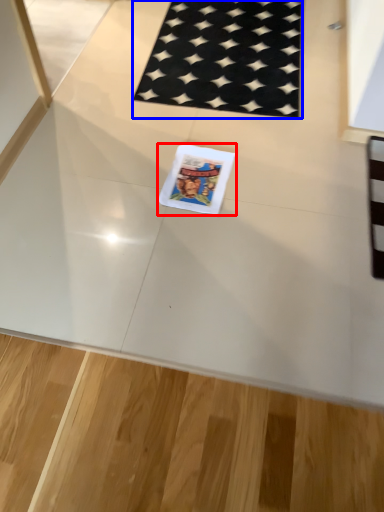
Question: Which object is closer to the camera taking this photo, comic book (highlighted by a red box) or mat (highlighted by a blue box)?

Choices:
 (A) comic book
 (B) mat

Answer: (A)